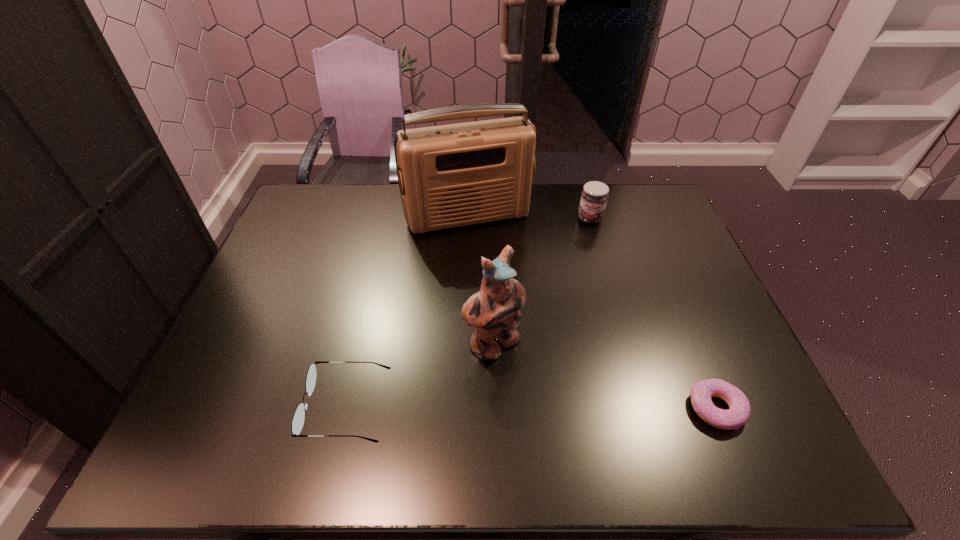
The image size is (960, 540). I want to click on blank space located 0.120m on the front-facing side of the figurine, so click(550, 398).

I want to click on jam that is at the far edge, so click(x=594, y=196).

I want to click on radio receiver that is at the far edge, so click(x=454, y=175).

Where is `spectacles located in the near edge section of the desktop`? The width and height of the screenshot is (960, 540). spectacles located in the near edge section of the desktop is located at coordinates 298,419.

Find the location of a particular element. doughnut that is positioned at the near edge is located at coordinates (739, 411).

Locate an element on the screen. The width and height of the screenshot is (960, 540). object that is at the right edge is located at coordinates (739, 411).

At what (x,y) coordinates should I click in order to perform the action: click on object situated at the near right corner. Please return your answer as a coordinate pair (x, y). This screenshot has width=960, height=540. Looking at the image, I should click on (739, 411).

Locate an element on the screen. The height and width of the screenshot is (540, 960). vacant region at the far edge of the desktop is located at coordinates (374, 218).

The height and width of the screenshot is (540, 960). Identify the location of vacant space at the near edge of the desktop. (634, 383).

Find the location of a particular element. free space at the left edge is located at coordinates (279, 333).